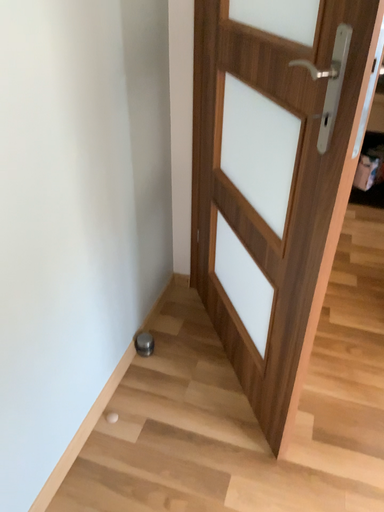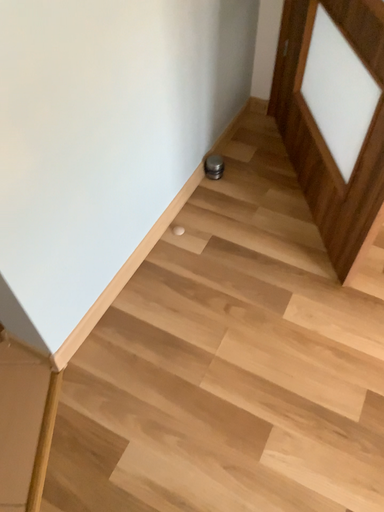
Question: How did the camera likely rotate when shooting the video?

Choices:
 (A) rotated right
 (B) rotated left

Answer: (B)